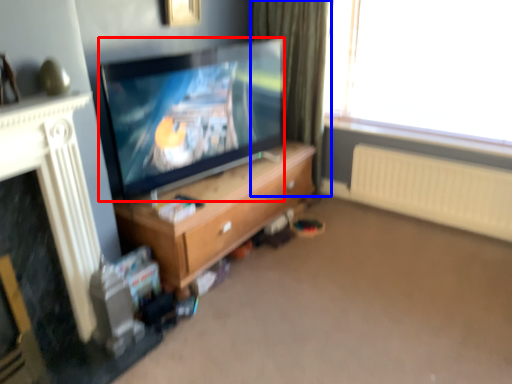
Question: Which of the following is the closest to the observer, television (highlighted by a red box) or curtain (highlighted by a blue box)?

Choices:
 (A) television
 (B) curtain

Answer: (A)